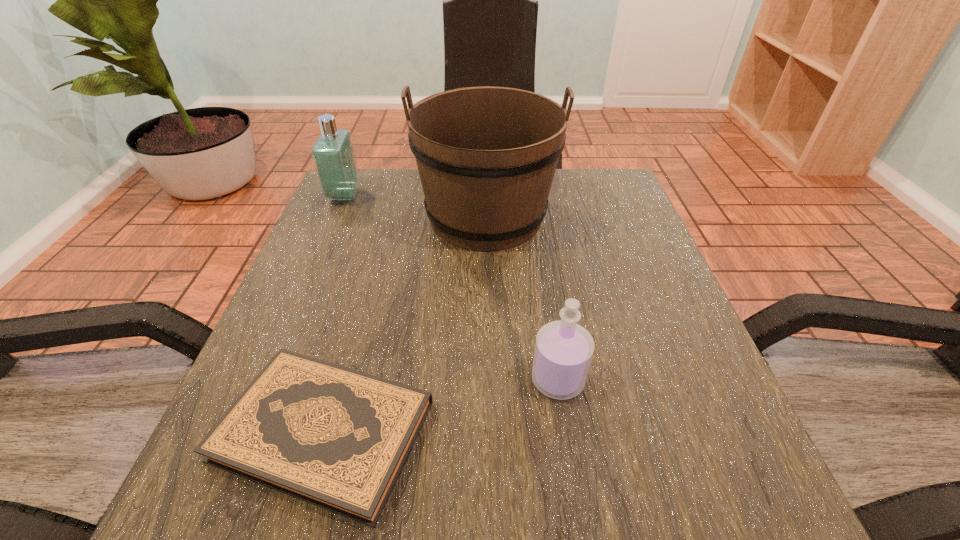
Where is `bucket`? This screenshot has width=960, height=540. bucket is located at coordinates (486, 156).

This screenshot has height=540, width=960. I want to click on the farther perfume, so 333,155.

Find the location of a particular element. the third tallest object is located at coordinates (563, 351).

Where is `the right perfume`? the right perfume is located at coordinates (563, 351).

Where is `hardback book`? hardback book is located at coordinates (338, 438).

Identify the location of blank space located on the left of the tallest object. Image resolution: width=960 pixels, height=540 pixels. (369, 217).

The height and width of the screenshot is (540, 960). In order to click on free space located on the front label of the left perfume in this screenshot , I will do `click(470, 195)`.

Locate an element on the screen. This screenshot has height=540, width=960. vacant space located on the front of the second shortest object is located at coordinates (578, 507).

Identify the location of vacant space situated 0.350m on the right of the shortest object. (675, 431).

This screenshot has height=540, width=960. In order to click on bucket located at the far edge in this screenshot , I will do pyautogui.click(x=486, y=156).